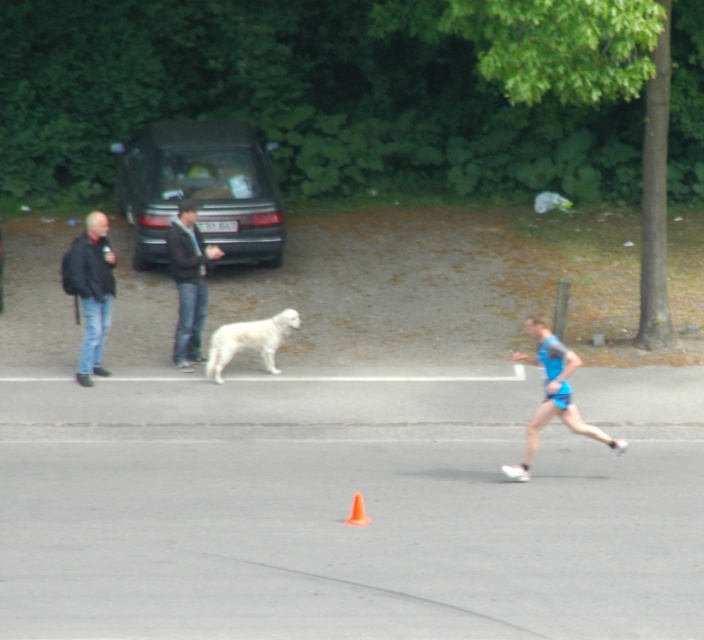
Question: Can you confirm if dark gray matte car at upper left is positioned to the left of dark blue jacket at left?

Choices:
 (A) yes
 (B) no

Answer: (B)

Question: Estimate the real-world distances between objects in this image. Which object is farther from the blue fabric runner at center?

Choices:
 (A) dark blue jacket at left
 (B) white fluffy dog at center
 (C) orange plastic traffic cone at center

Answer: (A)

Question: Estimate the real-world distances between objects in this image. Which object is farther from the dark gray matte car at upper left?

Choices:
 (A) dark gray jacket at center
 (B) blue fabric runner at center
 (C) white fluffy dog at center
 (D) orange plastic traffic cone at center

Answer: (D)

Question: Based on their relative distances, which object is nearer to the blue fabric runner at center?

Choices:
 (A) dark gray jacket at center
 (B) white fluffy dog at center
 (C) orange plastic traffic cone at center

Answer: (C)

Question: Does white fluffy dog at center appear on the right side of orange plastic traffic cone at center?

Choices:
 (A) yes
 (B) no

Answer: (B)

Question: Is dark gray jacket at center above white fluffy dog at center?

Choices:
 (A) yes
 (B) no

Answer: (A)